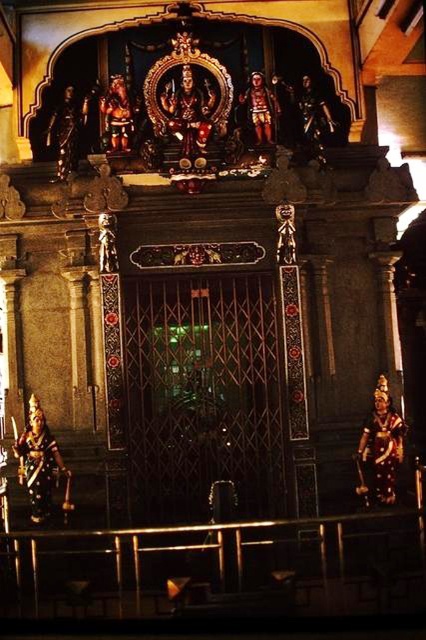
Is polished bronze statue at lower right thinner than polished bronze statue at lower left?

Yes, polished bronze statue at lower right is thinner than polished bronze statue at lower left.

Between point (399, 413) and point (32, 413), which one is positioned behind?

The point (399, 413) is behind.

I want to click on polished bronze statue at lower right, so click(x=379, y=449).